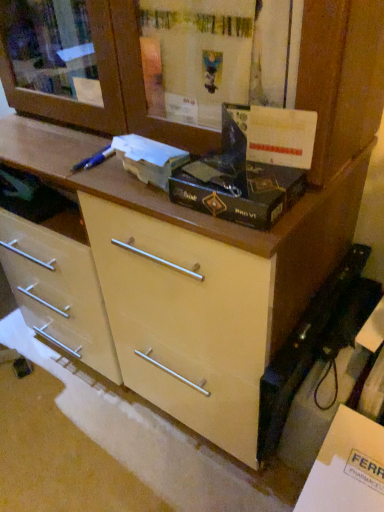
Question: Does white cardboard box at center, which appears as the second box when viewed from the right, appear on the left side of white matte cabinet at lower right?

Choices:
 (A) yes
 (B) no

Answer: (A)

Question: Is the depth of white cardboard box at center, which appears as the second box when viewed from the right, less than that of white matte cabinet at lower right?

Choices:
 (A) yes
 (B) no

Answer: (B)

Question: Could you tell me if white cardboard box at center, which appears as the second box when viewed from the right, is facing white matte cabinet at lower right?

Choices:
 (A) no
 (B) yes

Answer: (A)

Question: Is white cardboard box at center, acting as the first box starting from the left, positioned with its back to white matte cabinet at lower right?

Choices:
 (A) no
 (B) yes

Answer: (A)

Question: Is white cardboard box at center, acting as the first box starting from the left, bigger than white matte cabinet at lower right?

Choices:
 (A) no
 (B) yes

Answer: (A)

Question: In terms of height, does black matte box at center, arranged as the 2th box when viewed from the left, look taller or shorter compared to white cardboard box at center, which appears as the second box when viewed from the right?

Choices:
 (A) short
 (B) tall

Answer: (A)

Question: Is black matte box at center, which ranks as the 1th box in right-to-left order, bigger or smaller than white cardboard box at center, which appears as the second box when viewed from the right?

Choices:
 (A) small
 (B) big

Answer: (B)

Question: Is black matte box at center, which ranks as the 1th box in right-to-left order, in front of or behind white cardboard box at center, acting as the first box starting from the left, in the image?

Choices:
 (A) behind
 (B) front

Answer: (B)

Question: Does point (223, 217) appear closer or farther from the camera than point (155, 181)?

Choices:
 (A) farther
 (B) closer

Answer: (B)

Question: Is black matte box at center, which ranks as the 1th box in right-to-left order, to the left or to the right of white matte cabinet at lower right in the image?

Choices:
 (A) left
 (B) right

Answer: (A)

Question: From a real-world perspective, is black matte box at center, which ranks as the 1th box in right-to-left order, positioned above or below white matte cabinet at lower right?

Choices:
 (A) above
 (B) below

Answer: (A)

Question: In terms of size, does black matte box at center, which ranks as the 1th box in right-to-left order, appear bigger or smaller than white matte cabinet at lower right?

Choices:
 (A) small
 (B) big

Answer: (A)

Question: Considering the positions of black matte box at center, arranged as the 2th box when viewed from the left, and white matte cabinet at lower right in the image, is black matte box at center, arranged as the 2th box when viewed from the left, wider or thinner than white matte cabinet at lower right?

Choices:
 (A) thin
 (B) wide

Answer: (A)

Question: Visually, is white cardboard box at center, which appears as the second box when viewed from the right, positioned to the left or to the right of black matte box at center, which ranks as the 1th box in right-to-left order?

Choices:
 (A) left
 (B) right

Answer: (A)

Question: Based on their sizes in the image, would you say white cardboard box at center, which appears as the second box when viewed from the right, is bigger or smaller than black matte box at center, arranged as the 2th box when viewed from the left?

Choices:
 (A) big
 (B) small

Answer: (B)